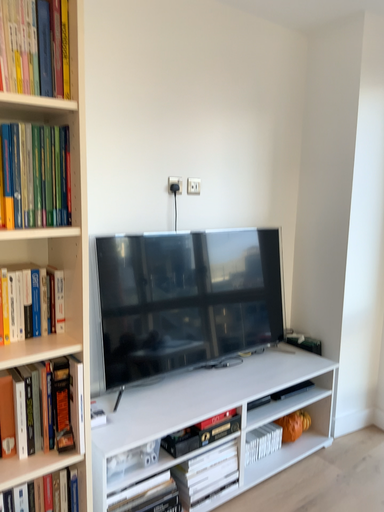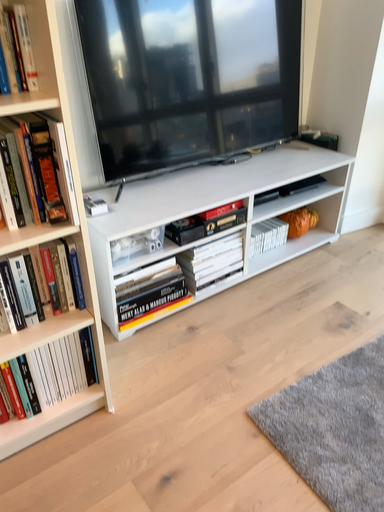
Question: How did the camera likely rotate when shooting the video?

Choices:
 (A) rotated downward
 (B) rotated upward

Answer: (A)